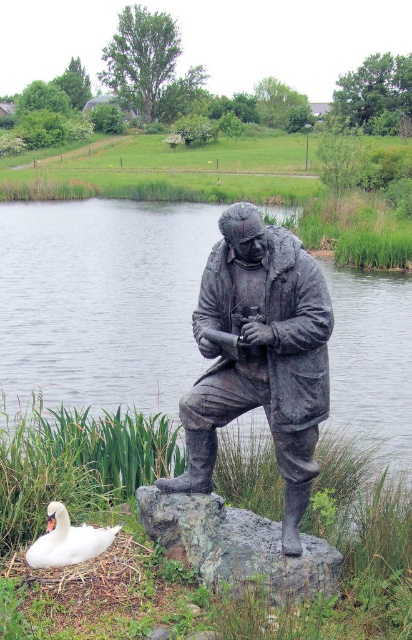
You are a landscape architect designing a path that must pass around the bronze statue at center. Based on its coordinates, what is the best direction to place the path so it remains visible from the main entrance?

The bronze statue at center is located at coordinates point (260,355), so placing the path to the north or east would keep it visible from the main entrance while allowing pedestrians to walk around it safely.

You are a landscape architect designing a path that must pass between the glossy water at statue right and the bronze statue at center. Based on the scene, which object should the path be closer to?

The glossy water at statue right might be wider than bronze statue at center, so the path should be closer to the bronze statue at center to ensure there is enough space.